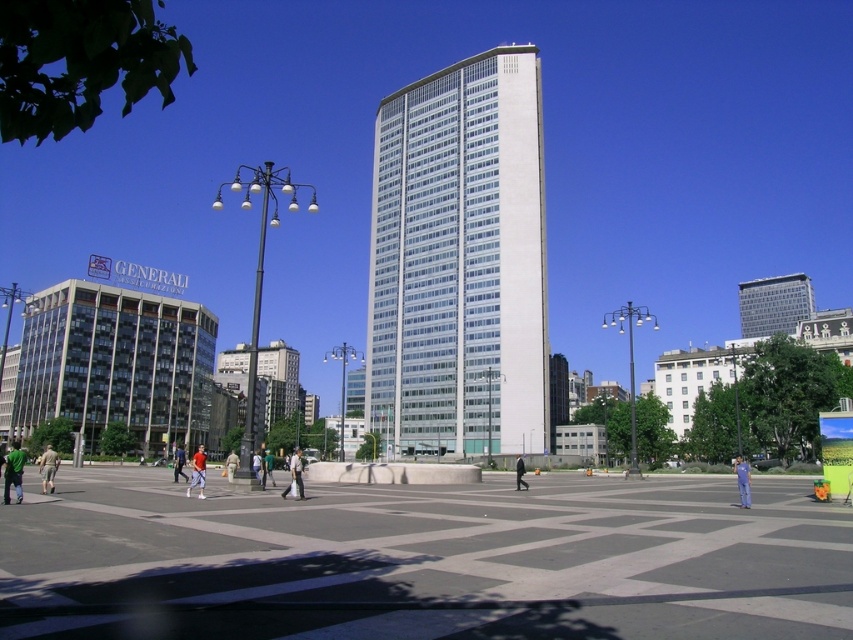
You are standing at the pedestrian plaza and want to locate two specific points on the image. The first point is at coordinates point (752,321) and the second is at point (252,461). Which point is closer to you?

Point (252,461) is closer to you because it is in front of point (752,321).

You are a photographer trying to capture both the white glass building at center and the green fabric shirt at lower left in a single shot. Which object will appear larger in your photo?

The white glass building at center will appear larger in the photo because it is bigger than the green fabric shirt at lower left.